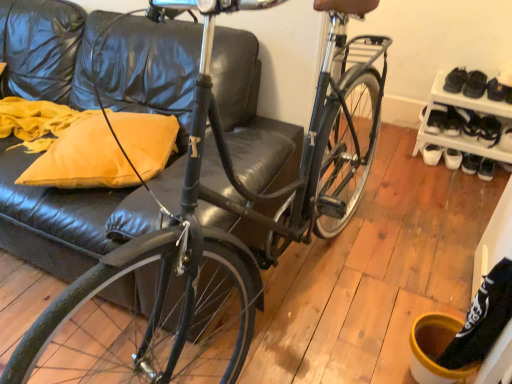
This screenshot has height=384, width=512. Identify the location of white plastic shoe rack at lower right. (465, 108).

Where is `black leather shoe at right, the second shoe when ordered from left to right`? The width and height of the screenshot is (512, 384). black leather shoe at right, the second shoe when ordered from left to right is located at coordinates (489, 131).

What do you see at coordinates (82, 159) in the screenshot? I see `yellow fabric pillow at left` at bounding box center [82, 159].

Find the location of a particular element. Image resolution: width=512 pixels, height=384 pixels. black leather shoe at right, the 2th shoe in the right-to-left sequence is located at coordinates (469, 123).

Relative to black leather shoe at right, the 1th shoe positioned from the left, is white plastic shoe rack at lower right in front or behind?

white plastic shoe rack at lower right is positioned closer to the viewer than black leather shoe at right, the 1th shoe positioned from the left.

Is the surface of white plastic shoe rack at lower right in direct contact with black leather shoe at right, the 2th shoe in the right-to-left sequence?

No.

From a real-world perspective, is white plastic shoe rack at lower right physically above black leather shoe at right, the 2th shoe in the right-to-left sequence?

Correct, in the physical world, white plastic shoe rack at lower right is higher than black leather shoe at right, the 2th shoe in the right-to-left sequence.

Which is in front, black leather shoe at right, the second shoe when ordered from left to right, or black leather shoe at right, the 1th shoe positioned from the left?

Positioned in front is black leather shoe at right, the second shoe when ordered from left to right.

Where is `shoe on the left of the black leather shoe at right, acting as the 1th shoe starting from the right`? shoe on the left of the black leather shoe at right, acting as the 1th shoe starting from the right is located at coordinates (469, 123).

Is black leather shoe at right, the 1th shoe positioned from the left, completely or partially inside black leather shoe at right, the second shoe when ordered from left to right?

No, black leather shoe at right, the 1th shoe positioned from the left, is not inside black leather shoe at right, the second shoe when ordered from left to right.

Can you confirm if black leather shoe at right, the 1th shoe positioned from the left, is wider than yellow fabric pillow at left?

In fact, black leather shoe at right, the 1th shoe positioned from the left, might be narrower than yellow fabric pillow at left.

Is point (455, 107) farther from camera compared to point (48, 168)?

Yes, point (455, 107) is farther from viewer.

Would you say black leather shoe at right, the 1th shoe positioned from the left, contains yellow fabric pillow at left?

No, yellow fabric pillow at left is not inside black leather shoe at right, the 1th shoe positioned from the left.

Looking at this image, from a real-world perspective, which is physically below, black leather shoe at right, the 1th shoe positioned from the left, or yellow fabric pillow at left?

In real-world perspective, black leather shoe at right, the 1th shoe positioned from the left, is lower.

This screenshot has width=512, height=384. I want to click on shelf that is behind the yellow fabric pillow at left, so click(465, 108).

From the image's perspective, relative to white plastic shoe rack at lower right, is yellow fabric pillow at left above or below?

From the image's perspective, yellow fabric pillow at left appears below white plastic shoe rack at lower right.

How distant is yellow fabric pillow at left from white plastic shoe rack at lower right?

The distance of yellow fabric pillow at left from white plastic shoe rack at lower right is 5.33 feet.

Consider the image. Which of these two, yellow fabric pillow at left or white plastic shoe rack at lower right, stands taller?

Standing taller between the two is white plastic shoe rack at lower right.

Can we say yellow fabric pillow at left lies outside black leather shoe at right, the 2th shoe in the right-to-left sequence?

Yes, yellow fabric pillow at left is outside of black leather shoe at right, the 2th shoe in the right-to-left sequence.

Looking at this image, how far apart are yellow fabric pillow at left and black leather shoe at right, the 1th shoe positioned from the left?

They are 5.78 feet apart.

Is point (82, 161) less distant than point (465, 128)?

Yes, point (82, 161) is in front of point (465, 128).

From the image's perspective, is yellow fabric pillow at left located above or below black leather shoe at right, the 1th shoe positioned from the left?

From the image's perspective, yellow fabric pillow at left appears below black leather shoe at right, the 1th shoe positioned from the left.

From a real-world perspective, is black leather shoe at right, the 1th shoe positioned from the left, on top of white plastic shoe rack at lower right?

No, from a real-world perspective, black leather shoe at right, the 1th shoe positioned from the left, is not above white plastic shoe rack at lower right.

Is black leather shoe at right, the 2th shoe in the right-to-left sequence, directly adjacent to white plastic shoe rack at lower right?

No, black leather shoe at right, the 2th shoe in the right-to-left sequence, is not in contact with white plastic shoe rack at lower right.

How different are the orientations of black leather shoe at right, the 2th shoe in the right-to-left sequence, and white plastic shoe rack at lower right in degrees?

The facing directions of black leather shoe at right, the 2th shoe in the right-to-left sequence, and white plastic shoe rack at lower right are 0.152 degrees apart.

In terms of width, does black leather shoe at right, the 1th shoe positioned from the left, look wider or thinner when compared to white plastic shoe rack at lower right?

Considering their sizes, black leather shoe at right, the 1th shoe positioned from the left, looks slimmer than white plastic shoe rack at lower right.

Considering the relative positions of black leather shoe at right, the second shoe when ordered from left to right, and white plastic shoe rack at lower right in the image provided, is black leather shoe at right, the second shoe when ordered from left to right, to the right of white plastic shoe rack at lower right from the viewer's perspective?

Correct, you'll find black leather shoe at right, the second shoe when ordered from left to right, to the right of white plastic shoe rack at lower right.

You are a GUI agent. You are given a task and a screenshot of the screen. Output one action in this format:
    pyautogui.click(x=<x>, y=<y>)
    Task: Click on the 1st shoe behind the white plastic shoe rack at lower right, counting from the anchor's position
    Image resolution: width=512 pixels, height=384 pixels.
    Given the screenshot: What is the action you would take?
    pyautogui.click(x=489, y=131)

Between black leather shoe at right, acting as the 1th shoe starting from the right, and white plastic shoe rack at lower right, which one has larger size?

With larger size is white plastic shoe rack at lower right.

Is black leather shoe at right, the second shoe when ordered from left to right, completely or partially outside of white plastic shoe rack at lower right?

Actually, black leather shoe at right, the second shoe when ordered from left to right, is at least partially inside white plastic shoe rack at lower right.

You are a GUI agent. You are given a task and a screenshot of the screen. Output one action in this format:
    pyautogui.click(x=<x>, y=<y>)
    Task: Click on the shoe that appears above the white plastic shoe rack at lower right (from the image's perspective)
    
    Given the screenshot: What is the action you would take?
    pyautogui.click(x=469, y=123)

In order to click on shoe on the right of the black leather shoe at right, the 2th shoe in the right-to-left sequence in this screenshot , I will do `click(489, 131)`.

When comparing their distances from black leather shoe at right, the 2th shoe in the right-to-left sequence, does white plastic shoe rack at lower right or black leather shoe at right, acting as the 1th shoe starting from the right, seem closer?

black leather shoe at right, acting as the 1th shoe starting from the right, is closer to black leather shoe at right, the 2th shoe in the right-to-left sequence.

Which object lies nearer to the anchor point black leather shoe at right, acting as the 1th shoe starting from the right, yellow fabric pillow at left or white plastic shoe rack at lower right?

Among the two, white plastic shoe rack at lower right is located nearer to black leather shoe at right, acting as the 1th shoe starting from the right.

Estimate the real-world distances between objects in this image. Which object is further from yellow fabric pillow at left, black leather shoe at right, acting as the 1th shoe starting from the right, or black leather shoe at right, the 2th shoe in the right-to-left sequence?

black leather shoe at right, acting as the 1th shoe starting from the right, lies further to yellow fabric pillow at left than the other object.

Looking at the image, which one is located further to black leather shoe at right, the 2th shoe in the right-to-left sequence, yellow fabric pillow at left or white plastic shoe rack at lower right?

The object further to black leather shoe at right, the 2th shoe in the right-to-left sequence, is yellow fabric pillow at left.

Considering their positions, is yellow fabric pillow at left positioned further to white plastic shoe rack at lower right than black leather shoe at right, the 2th shoe in the right-to-left sequence?

yellow fabric pillow at left.

Estimate the real-world distances between objects in this image. Which object is closer to white plastic shoe rack at lower right, black leather shoe at right, the second shoe when ordered from left to right, or black leather shoe at right, the 2th shoe in the right-to-left sequence?

black leather shoe at right, the 2th shoe in the right-to-left sequence, is closer to white plastic shoe rack at lower right.

Considering their positions, is white plastic shoe rack at lower right positioned further to black leather shoe at right, acting as the 1th shoe starting from the right, than yellow fabric pillow at left?

The object further to black leather shoe at right, acting as the 1th shoe starting from the right, is yellow fabric pillow at left.

From the image, which object appears to be nearer to black leather shoe at right, the 2th shoe in the right-to-left sequence, black leather shoe at right, acting as the 1th shoe starting from the right, or yellow fabric pillow at left?

Among the two, black leather shoe at right, acting as the 1th shoe starting from the right, is located nearer to black leather shoe at right, the 2th shoe in the right-to-left sequence.

This screenshot has width=512, height=384. In order to click on shoe situated between yellow fabric pillow at left and black leather shoe at right, the second shoe when ordered from left to right, from left to right in this screenshot , I will do `click(469, 123)`.

This screenshot has height=384, width=512. I want to click on shelf between yellow fabric pillow at left and black leather shoe at right, the 2th shoe in the right-to-left sequence, so click(465, 108).

Locate an element on the screen. This screenshot has width=512, height=384. shelf between yellow fabric pillow at left and black leather shoe at right, the second shoe when ordered from left to right is located at coordinates (465, 108).

You are a GUI agent. You are given a task and a screenshot of the screen. Output one action in this format:
    pyautogui.click(x=<x>, y=<y>)
    Task: Click on the shoe positioned between white plastic shoe rack at lower right and black leather shoe at right, the 1th shoe positioned from the left, from near to far
    This screenshot has width=512, height=384.
    Given the screenshot: What is the action you would take?
    pyautogui.click(x=489, y=131)